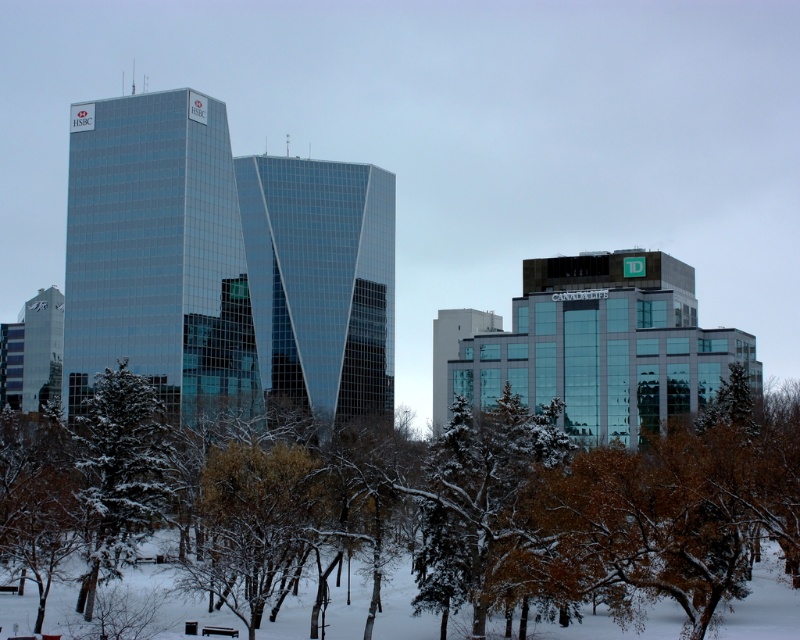
Which is above, green leafy tree at center or matte glass building at center?

Positioned higher is matte glass building at center.

Does green leafy tree at center have a larger size compared to matte glass building at center?

Yes, green leafy tree at center is bigger than matte glass building at center.

Describe the element at coordinates (514, 513) in the screenshot. I see `green leafy tree at center` at that location.

Locate an element on the screen. Image resolution: width=800 pixels, height=640 pixels. green leafy tree at center is located at coordinates (514, 513).

Which is more to the left, green leafy tree at center or green matte tree at lower left?

From the viewer's perspective, green matte tree at lower left appears more on the left side.

Is green leafy tree at center bigger than green matte tree at lower left?

Indeed, green leafy tree at center has a larger size compared to green matte tree at lower left.

Is point (448, 451) closer to viewer compared to point (81, 424)?

Yes.

I want to click on green leafy tree at center, so click(x=514, y=513).

Measure the distance between transparent glass skyscraper at center and camera.

They are 512.72 feet apart.

Between transparent glass skyscraper at center and green matte tree at lower left, which one is positioned higher?

Positioned higher is transparent glass skyscraper at center.

You are a GUI agent. You are given a task and a screenshot of the screen. Output one action in this format:
    pyautogui.click(x=<x>, y=<y>)
    Task: Click on the transparent glass skyscraper at center
    
    Given the screenshot: What is the action you would take?
    pyautogui.click(x=320, y=282)